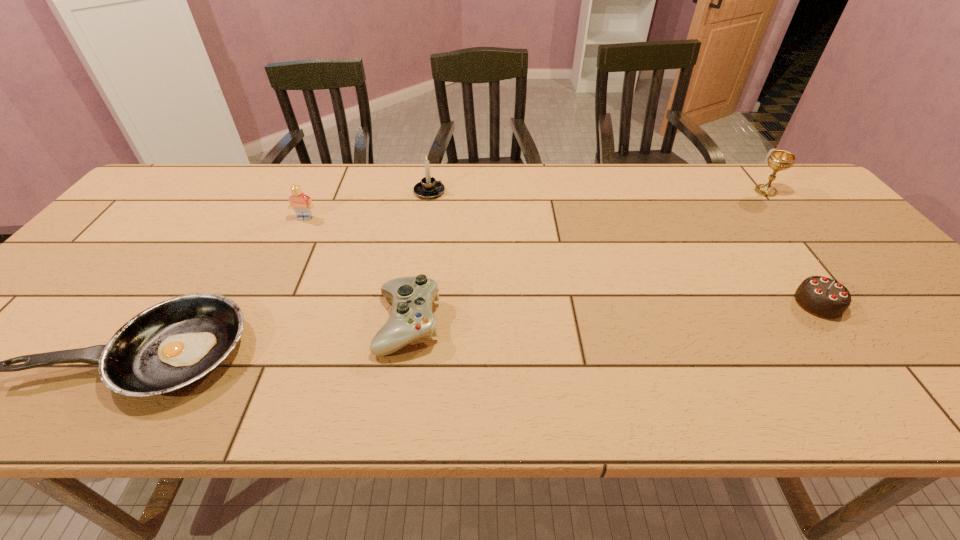
Identify the location of candle holder. (428, 188).

You are a GUI agent. You are given a task and a screenshot of the screen. Output one action in this format:
    pyautogui.click(x=<x>, y=<y>)
    Task: Click on the chalice
    The width and height of the screenshot is (960, 540).
    Given the screenshot: What is the action you would take?
    pyautogui.click(x=779, y=160)

Locate an element on the screen. Lego is located at coordinates (301, 203).

The image size is (960, 540). Identify the location of control. (411, 318).

Where is `chocolate cake`? Image resolution: width=960 pixels, height=540 pixels. chocolate cake is located at coordinates (823, 297).

Locate an element on the screen. This screenshot has height=540, width=960. vacant space situated with a handle on the side of the candle holder is located at coordinates (468, 192).

Locate an element on the screen. vacant space located 0.070m on the front of the rightmost object is located at coordinates coord(782,211).

This screenshot has height=540, width=960. What are the coordinates of `free region located 0.240m on the front-facing side of the fourth nearest object` in the screenshot? It's located at (276, 280).

In order to click on vacant space located on the right of the control in this screenshot , I will do `click(620, 323)`.

Locate an element on the screen. vacant area located 0.170m on the front of the chocolate cake is located at coordinates (879, 386).